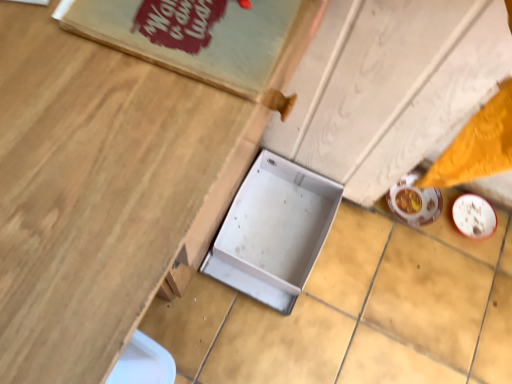
This screenshot has height=384, width=512. What do you see at coordinates (273, 231) in the screenshot? I see `metallic silver box at center` at bounding box center [273, 231].

You are a GUI agent. You are given a task and a screenshot of the screen. Output one action in this format:
    pyautogui.click(x=<x>, y=<y>)
    Task: Click on the metallic silver box at center
    This screenshot has height=384, width=512.
    Given the screenshot: What is the action you would take?
    pyautogui.click(x=273, y=231)

This screenshot has width=512, height=384. What do you see at coordinates (100, 191) in the screenshot?
I see `metallic silver tray at center` at bounding box center [100, 191].

I want to click on metallic silver tray at center, so click(100, 191).

Where is `metallic silver box at center`? Image resolution: width=512 pixels, height=384 pixels. metallic silver box at center is located at coordinates (273, 231).

Is metallic silver tray at center to the left of metallic silver box at center from the viewer's perspective?

Yes, metallic silver tray at center is to the left of metallic silver box at center.

Which is in front, metallic silver tray at center or metallic silver box at center?

metallic silver tray at center is closer to the camera.

Is point (189, 181) farther from viewer compared to point (247, 240)?

No, it is not.

From the image's perspective, is metallic silver tray at center located above or below metallic silver box at center?

Clearly, from the image's perspective, metallic silver tray at center is above metallic silver box at center.

From a real-world perspective, is metallic silver tray at center over metallic silver box at center?

Yes, from a real-world perspective, metallic silver tray at center is on top of metallic silver box at center.

Between metallic silver tray at center and metallic silver box at center, which one has smaller width?

metallic silver box at center.

Which of these two, metallic silver tray at center or metallic silver box at center, stands shorter?

metallic silver box at center.

Can you confirm if metallic silver tray at center is bigger than metallic silver box at center?

Correct, metallic silver tray at center is larger in size than metallic silver box at center.

Do you think metallic silver tray at center is within metallic silver box at center, or outside of it?

metallic silver tray at center is located beyond the bounds of metallic silver box at center.

Is metallic silver tray at center not close to metallic silver box at center?

No, there isn't a large distance between metallic silver tray at center and metallic silver box at center.

Is metallic silver tray at center facing away from metallic silver box at center?

metallic silver tray at center does not have its back to metallic silver box at center.

How many degrees apart are the facing directions of metallic silver tray at center and metallic silver box at center?

The angle between the facing direction of metallic silver tray at center and the facing direction of metallic silver box at center is 86 degrees.

I want to click on table above the metallic silver box at center (from a real-world perspective), so click(100, 191).

Is metallic silver box at center at the right side of metallic silver tray at center?

Yes.

Is metallic silver box at center closer to the viewer compared to metallic silver tray at center?

No, metallic silver box at center is further to the viewer.

Does point (296, 222) appear closer or farther from the camera than point (51, 325)?

Point (296, 222) is positioned farther from the camera compared to point (51, 325).

From the image's perspective, is metallic silver box at center over metallic silver tray at center?

Actually, metallic silver box at center appears below metallic silver tray at center in the image.

From a real-world perspective, is metallic silver box at center located beneath metallic silver tray at center?

Correct, in the physical world, metallic silver box at center is lower than metallic silver tray at center.

Does metallic silver box at center have a greater width compared to metallic silver tray at center?

No.

In terms of height, does metallic silver box at center look taller or shorter compared to metallic silver tray at center?

Clearly, metallic silver box at center is shorter compared to metallic silver tray at center.

Considering the sizes of objects metallic silver box at center and metallic silver tray at center in the image provided, who is smaller, metallic silver box at center or metallic silver tray at center?

Smaller between the two is metallic silver box at center.

Do you think metallic silver box at center is within metallic silver tray at center, or outside of it?

A: metallic silver box at center is not inside metallic silver tray at center, it's outside.

Is metallic silver box at center positioned far away from metallic silver tray at center?

No, metallic silver box at center is not far away from metallic silver tray at center.

Is metallic silver box at center oriented towards metallic silver tray at center?

No, metallic silver box at center is not turned towards metallic silver tray at center.

Measure the distance between metallic silver box at center and metallic silver tray at center.

metallic silver box at center is 26.62 inches away from metallic silver tray at center.

This screenshot has height=384, width=512. I want to click on box on the right of metallic silver tray at center, so click(x=273, y=231).

Locate an element on the screen. This screenshot has height=384, width=512. box below the metallic silver tray at center (from the image's perspective) is located at coordinates (273, 231).

Locate an element on the screen. table that is on the left side of metallic silver box at center is located at coordinates (100, 191).